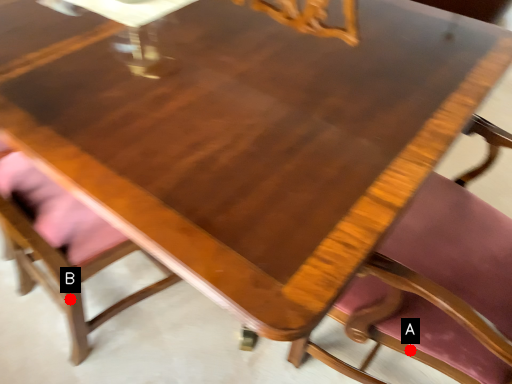
Question: Two points are circled on the image, labeled by A and B beside each circle. Which point is closer to the camera taking this photo?

Choices:
 (A) A is closer
 (B) B is closer

Answer: (A)